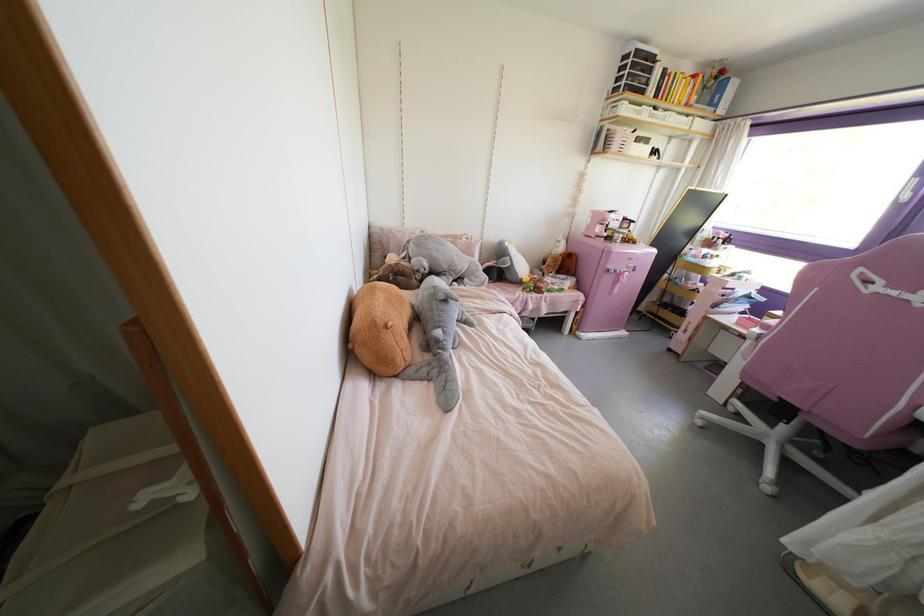
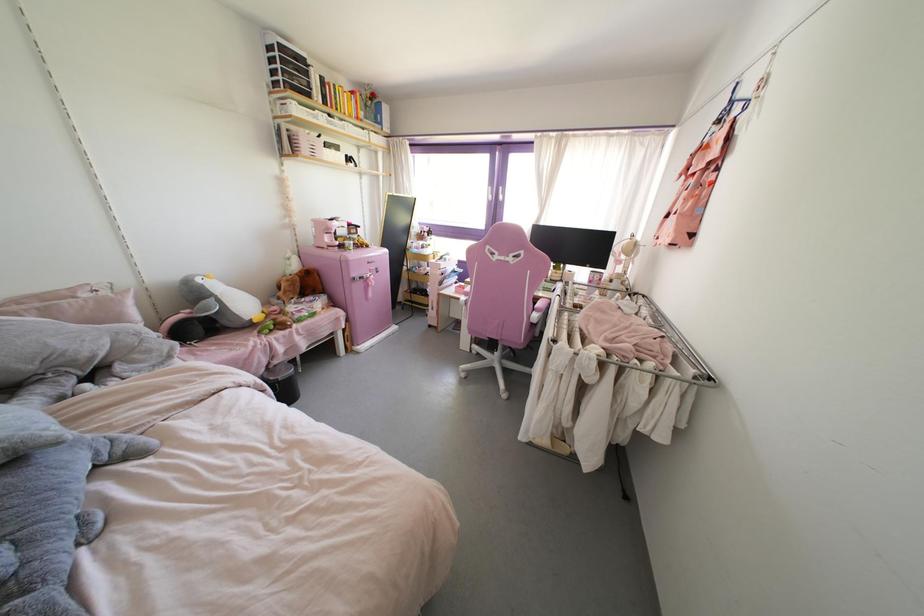
Where in the second image is the point corresponding to pixel 578 338 from the first image?

(357, 352)